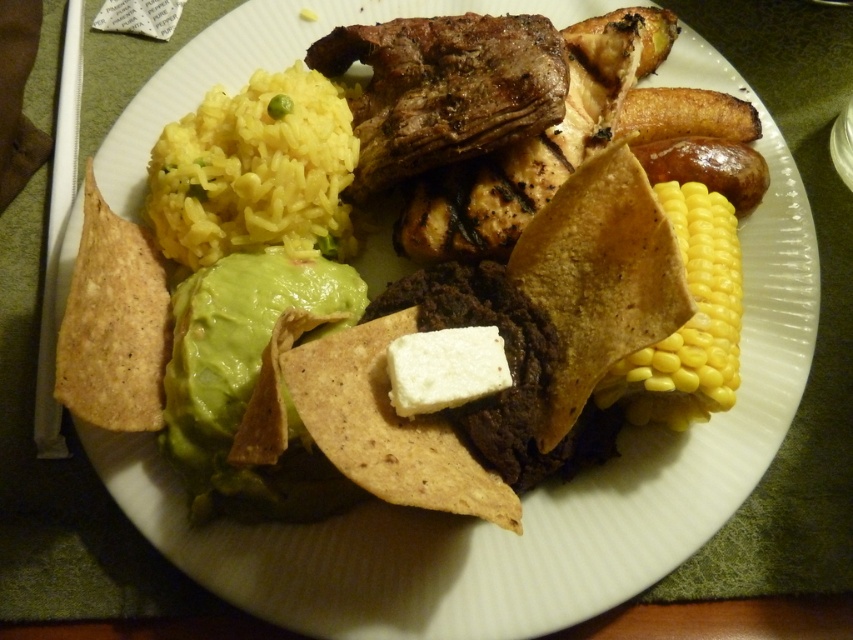
In the scene shown: You are a food critic evaluating the presentation of this dish. Based on the height of the grilled brown meat at center and the yellow matte corn at right, which component appears to be the taller one?

The yellow matte corn at right is taller than the grilled brown meat at center.

You are a food critic who wants to take a photo of the grilled brown meat at center and white creamy cheese at center. Which one is closer to the camera?

The grilled brown meat at center is closer to the camera because the white creamy cheese at center is behind it.